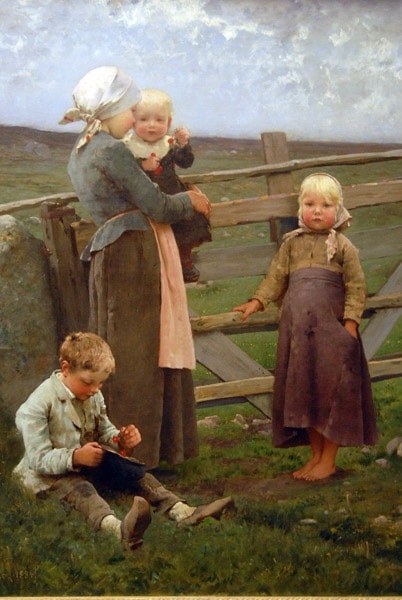
Find the location of `coat`. coat is located at coordinates (58, 413).